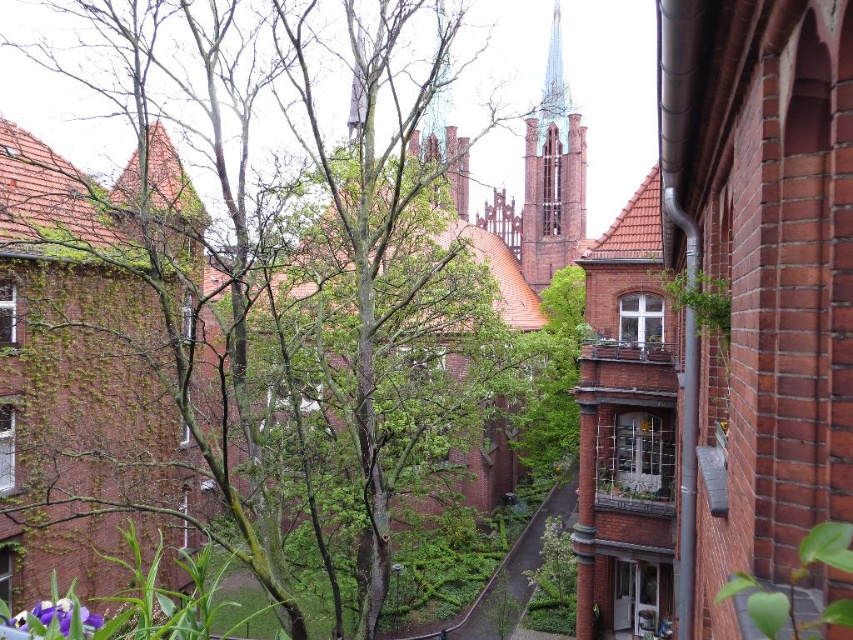
Question: In this image, where is green leafy alley at center located relative to purple matte flower at lower left?

Choices:
 (A) left
 (B) right

Answer: (B)

Question: Estimate the real-world distances between objects in this image. Which object is farther from the purple matte flower at lower left?

Choices:
 (A) green leafy tree at center
 (B) green leafy alley at center

Answer: (B)

Question: Which point is farther from the camera taking this photo?

Choices:
 (A) (543, 99)
 (B) (436, 188)
 (C) (439, 632)

Answer: (A)

Question: Can you confirm if brown brick tower at center is positioned above purple matte flower at lower left?

Choices:
 (A) no
 (B) yes

Answer: (B)

Question: Estimate the real-world distances between objects in this image. Which object is farther from the green leafy alley at center?

Choices:
 (A) brown brick tower at center
 (B) green leafy tree at center

Answer: (A)

Question: Is brown brick tower at center below green leafy alley at center?

Choices:
 (A) no
 (B) yes

Answer: (A)